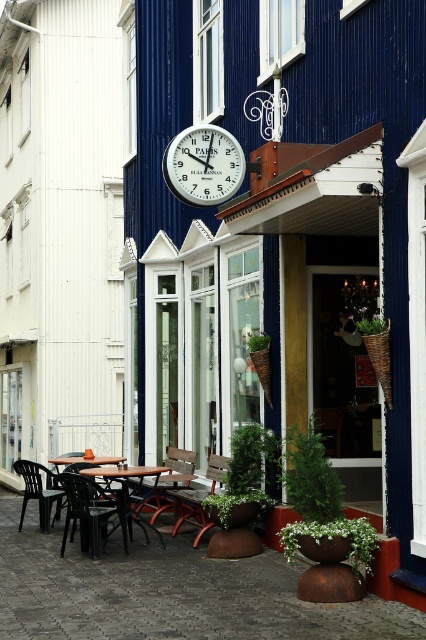
Who is positioned more to the right, white plastic clock at center or wooden table at lower left?

From the viewer's perspective, white plastic clock at center appears more on the right side.

Does point (169, 173) come in front of point (83, 458)?

Yes, point (169, 173) is in front of point (83, 458).

This screenshot has height=640, width=426. I want to click on white plastic clock at center, so click(204, 164).

Does white plastic clock at center come behind wooden chair at center?

No, white plastic clock at center is closer to the viewer.

Is white plastic clock at center smaller than wooden chair at center?

Yes, white plastic clock at center is smaller than wooden chair at center.

Measure the distance between point (207,132) and camera.

They are 10.66 meters apart.

The width and height of the screenshot is (426, 640). I want to click on white plastic clock at center, so click(204, 164).

Does wooden table at center appear under wooden chair at center?

No, wooden table at center is not below wooden chair at center.

Is point (138, 488) behind point (222, 467)?

Yes, point (138, 488) is farther from viewer.

Between point (138, 504) and point (189, 516), which one is positioned in front?

Point (189, 516) is in front.

In order to click on wooden table at center in this screenshot , I will do `click(132, 490)`.